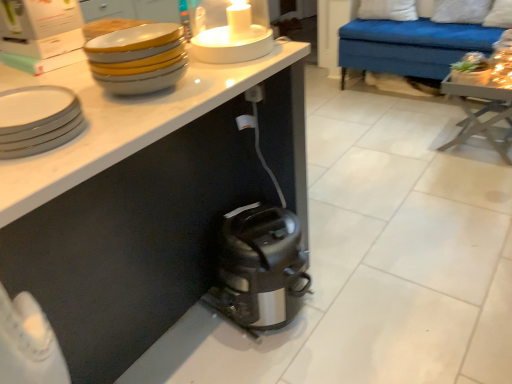
Find the location of a particular element. The image size is (512, 384). vacant region to the right of satin silver toaster at lower center is located at coordinates coord(342,297).